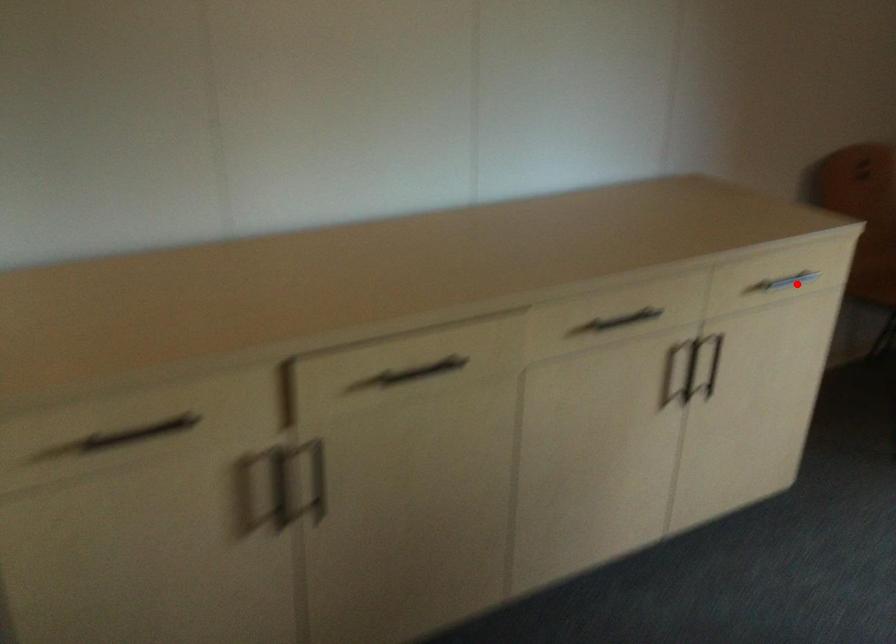
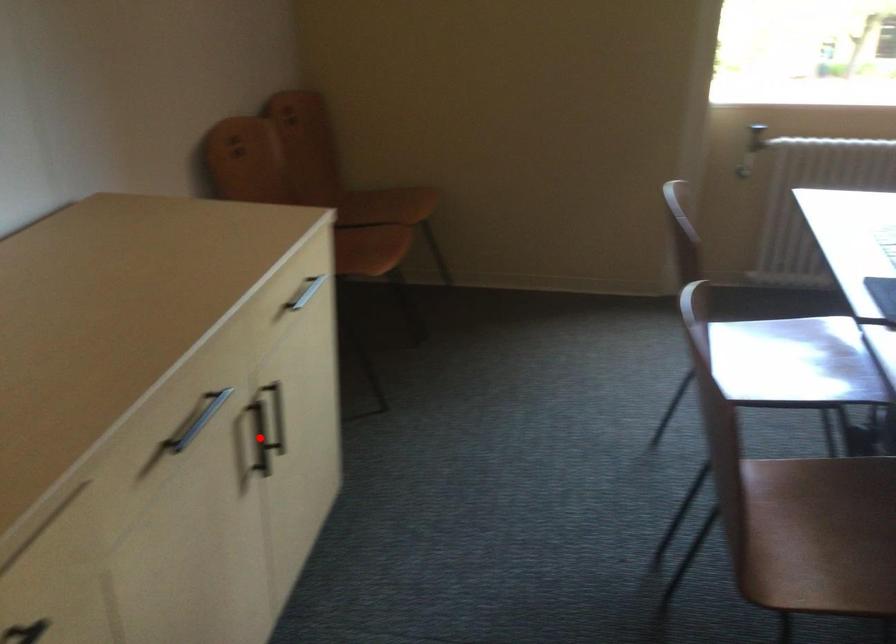
I am providing you with two images of the same scene from different viewpoints. A red point is marked on the first image and another point is marked on the second image. Do the highlighted points in image1 and image2 indicate the same real-world spot?

No